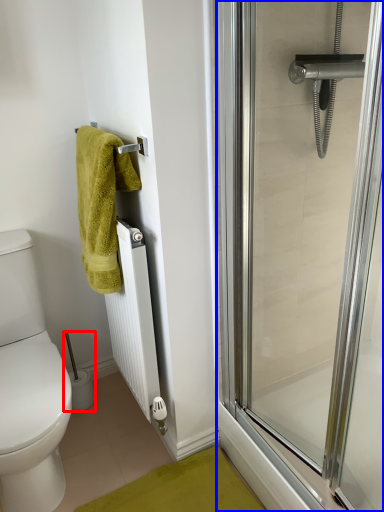
Question: Which point is further to the camera, toilet paper (highlighted by a red box) or screen door (highlighted by a blue box)?

Choices:
 (A) toilet paper
 (B) screen door

Answer: (A)